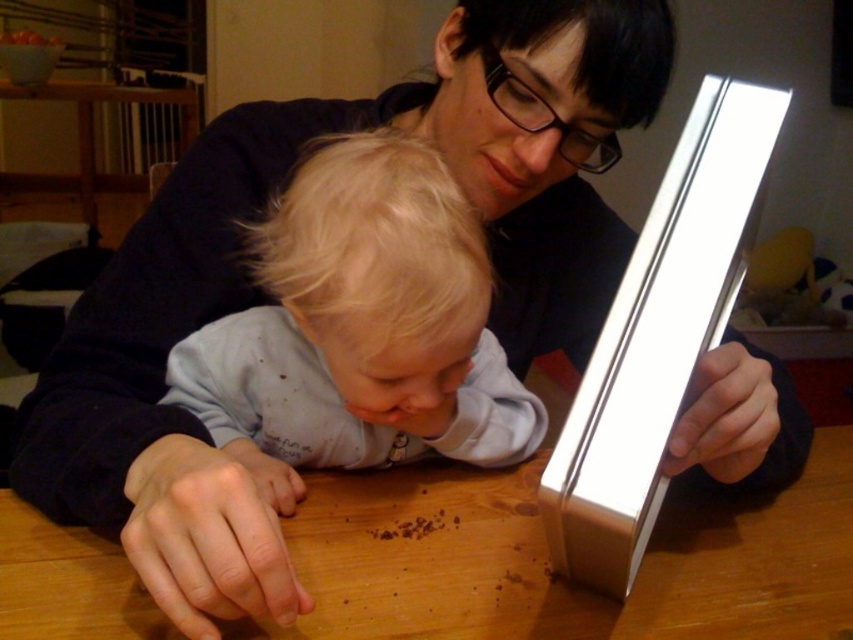
You are standing 36 inches away from the wooden table. You want to reach the point at coordinates point [827,464] on the table. Can you reach it without moving closer?

The point at point [827,464] is 30.86 inches away from you, so yes, you can reach it without moving closer since you are 36 inches away.

You are a robot trying to reach a point on the table. You can choose between two points labeled as point (x=561, y=592) and point (x=369, y=305). Which point is closer to you?

Point (x=369, y=305) is closer to you because it is less further than point (x=561, y=592).

You are a guest at this home and need to place a rectangular tray on the wooden table at center. The tray is as wide as the light blue cotton shirt at center. Will the tray fit on the table?

The wooden table at center is wider than the light blue cotton shirt at center, so the tray, which is as wide as the shirt, will fit on the table.